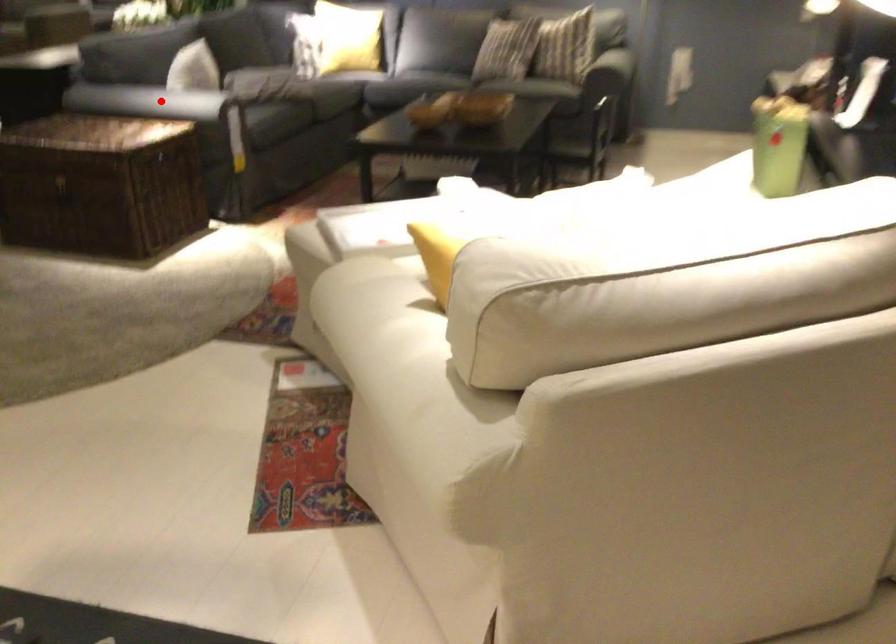
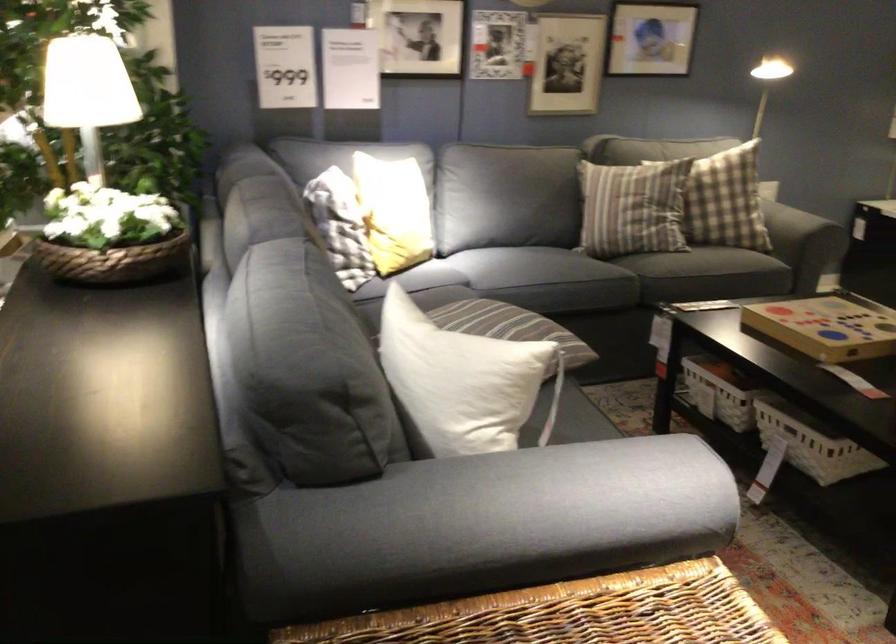
Question: I am providing you with two images of the same scene from different viewpoints. A red point is shown in image1. For the corresponding object point in image2, is it positioned nearer or farther from the camera?

Choices:
 (A) Nearer
 (B) Farther

Answer: (A)